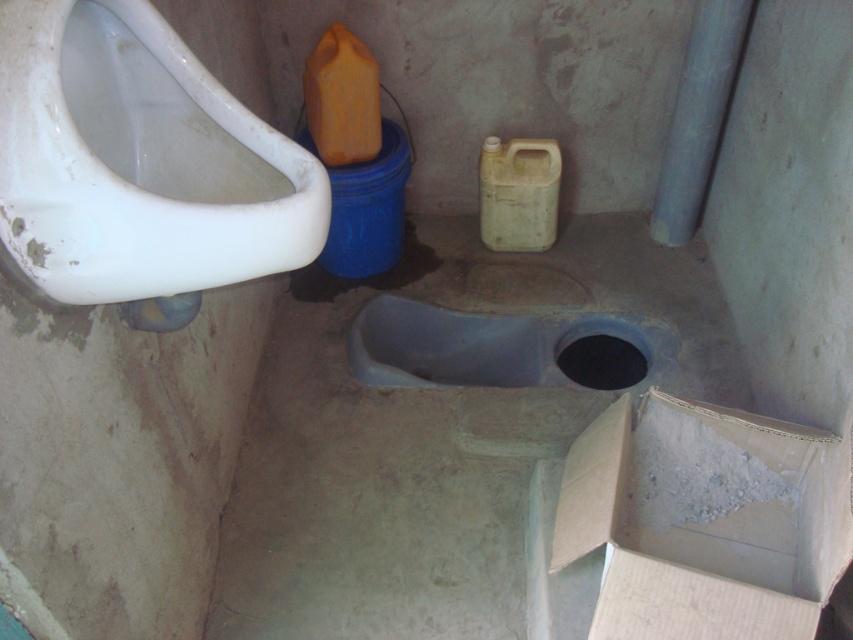
Question: Can you confirm if white glossy urinal at left is thinner than matte plastic toilet bowl at center?

Choices:
 (A) no
 (B) yes

Answer: (A)

Question: Is white glossy urinal at left to the left of matte plastic toilet bowl at center from the viewer's perspective?

Choices:
 (A) no
 (B) yes

Answer: (B)

Question: Is white glossy urinal at left thinner than matte plastic toilet bowl at center?

Choices:
 (A) no
 (B) yes

Answer: (A)

Question: Which object is closer to the camera taking this photo?

Choices:
 (A) matte plastic toilet bowl at center
 (B) white glossy urinal at left

Answer: (B)